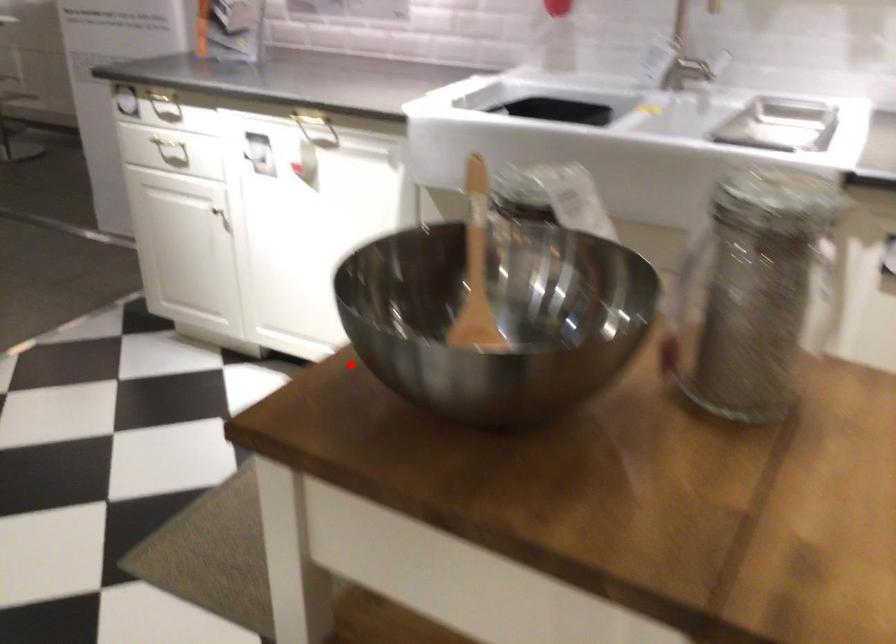
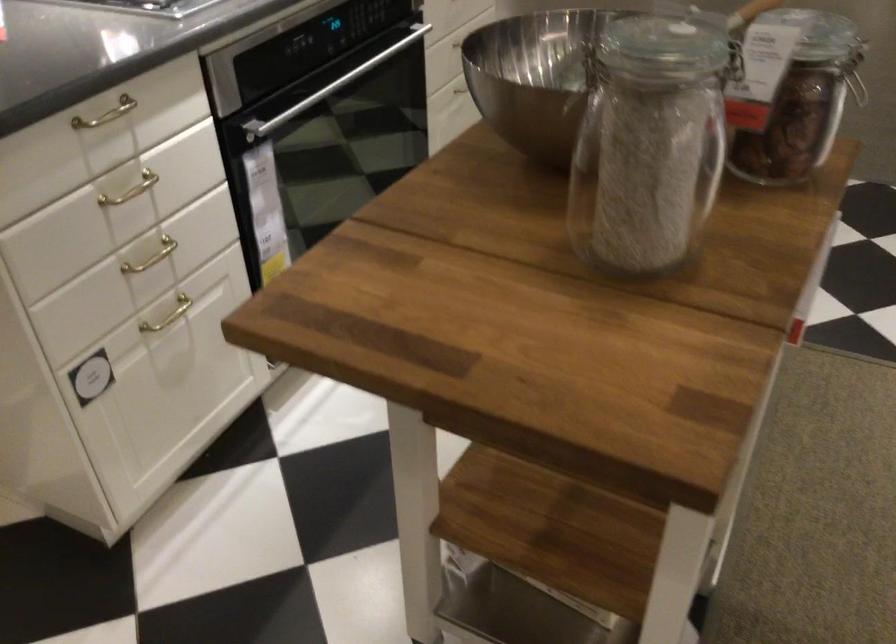
Where in the second image is the point corresponding to the highlighted location from the first image?

(535, 77)